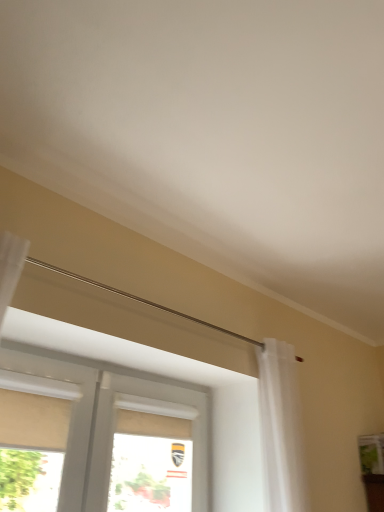
This screenshot has height=512, width=384. What do you see at coordinates (113, 424) in the screenshot?
I see `white matte window at lower left` at bounding box center [113, 424].

Identify the location of white matte window at lower left. (113, 424).

Identify the location of white matte window at lower left. (x=113, y=424).